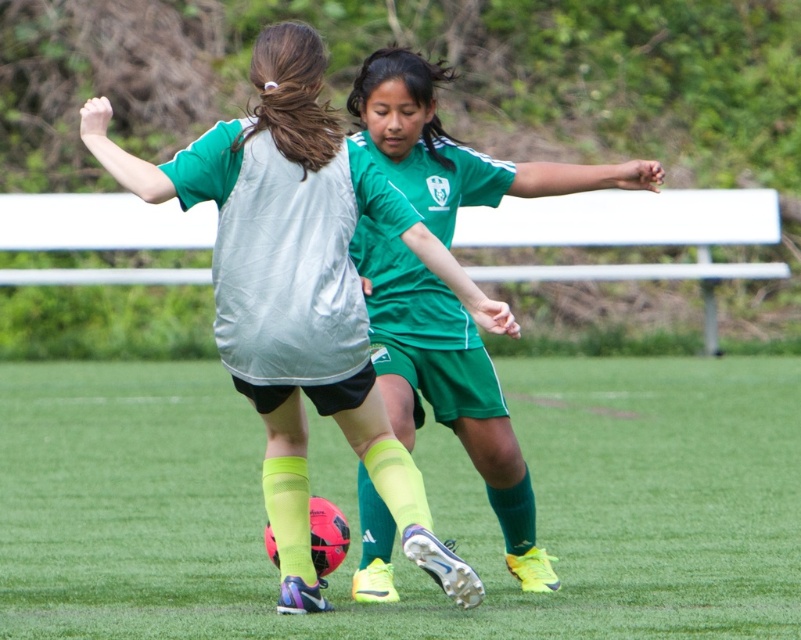
You are a soccer coach analyzing the players during a match. You notice two points on the field marked as point (659, 541) and point (407, 276). Which point is closer to the camera?

Point (407, 276) is closer to the camera because it is less further than point (659, 541).